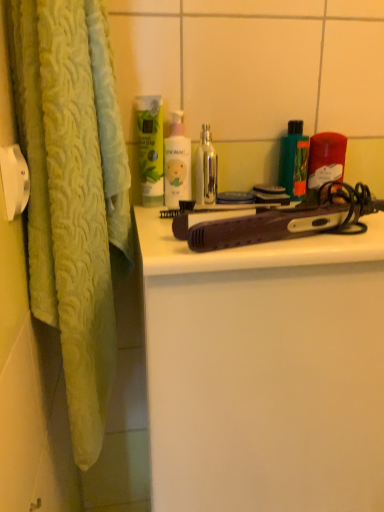
Question: From the image's perspective, is metallic silver bottle at center on top of green matte lotion at upper center, which is the 1th cleaning product in left-to-right order?

Choices:
 (A) no
 (B) yes

Answer: (A)

Question: Can you confirm if metallic silver bottle at center is thinner than green matte lotion at upper center, which is the 1th cleaning product in left-to-right order?

Choices:
 (A) yes
 (B) no

Answer: (B)

Question: From the image's perspective, is metallic silver bottle at center under green matte lotion at upper center, which is the 1th cleaning product in left-to-right order?

Choices:
 (A) yes
 (B) no

Answer: (A)

Question: Is metallic silver bottle at center in front of green matte lotion at upper center, which is the 1th cleaning product in left-to-right order?

Choices:
 (A) no
 (B) yes

Answer: (A)

Question: From a real-world perspective, is metallic silver bottle at center under green matte lotion at upper center, which is the second cleaning product in right-to-left order?

Choices:
 (A) no
 (B) yes

Answer: (B)

Question: Does metallic silver bottle at center turn towards green matte lotion at upper center, which is the second cleaning product in right-to-left order?

Choices:
 (A) no
 (B) yes

Answer: (A)

Question: From a real-world perspective, is white matte bottle at center, which is counted as the first cleaning product, starting from the right, below purple plastic hair straightener at center?

Choices:
 (A) no
 (B) yes

Answer: (A)

Question: Is white matte bottle at center, which is counted as the first cleaning product, starting from the right, turned away from purple plastic hair straightener at center?

Choices:
 (A) yes
 (B) no

Answer: (B)

Question: Is white matte bottle at center, which is counted as the first cleaning product, starting from the right, shorter than purple plastic hair straightener at center?

Choices:
 (A) yes
 (B) no

Answer: (A)

Question: Does white matte bottle at center, the 2th cleaning product when ordered from left to right, turn towards purple plastic hair straightener at center?

Choices:
 (A) yes
 (B) no

Answer: (B)

Question: From the image's perspective, is white matte bottle at center, which is counted as the first cleaning product, starting from the right, beneath purple plastic hair straightener at center?

Choices:
 (A) yes
 (B) no

Answer: (B)

Question: Is white matte bottle at center, which is counted as the first cleaning product, starting from the right, further to camera compared to purple plastic hair straightener at center?

Choices:
 (A) no
 (B) yes

Answer: (B)

Question: Considering the relative sizes of green matte bottle at upper right, arranged as the 2th product when viewed from the right, and translucent plastic container at upper right, which ranks as the 1th product in right-to-left order, in the image provided, is green matte bottle at upper right, arranged as the 2th product when viewed from the right, shorter than translucent plastic container at upper right, which ranks as the 1th product in right-to-left order,?

Choices:
 (A) no
 (B) yes

Answer: (A)